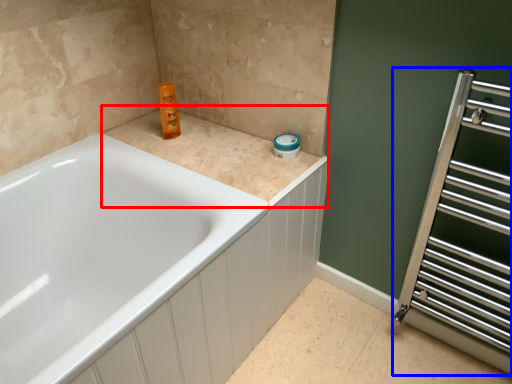
Question: Which point is further to the camera, counter top (highlighted by a red box) or screen door (highlighted by a blue box)?

Choices:
 (A) counter top
 (B) screen door

Answer: (A)